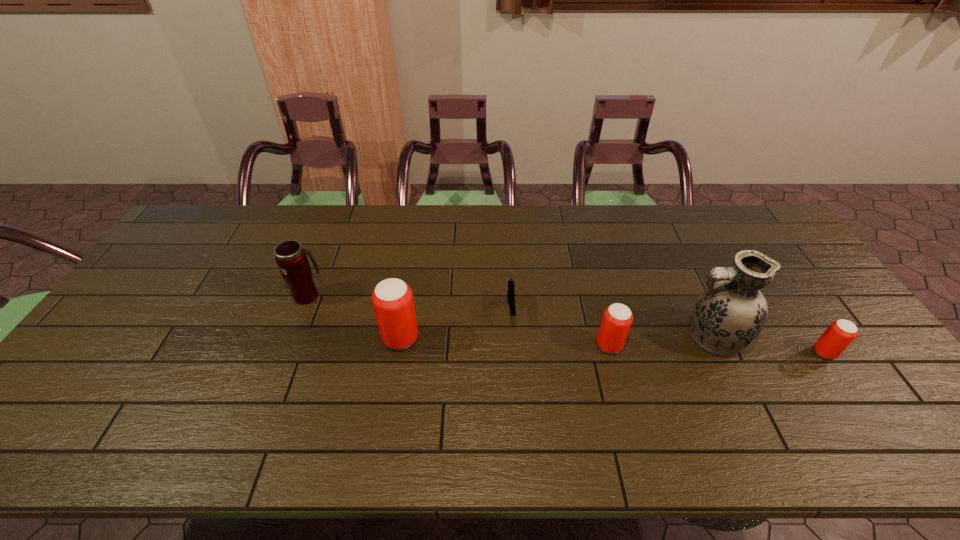
At what (x,y) coordinates should I click in order to perform the action: click on the second object from right to left. Please return your answer as a coordinate pair (x, y). Looking at the image, I should click on (728, 315).

I want to click on vacant area located on the right of the second object from left to right, so click(x=530, y=338).

The width and height of the screenshot is (960, 540). What are the coordinates of `free space located on the left of the second shortest beer can` in the screenshot? It's located at (559, 345).

At what (x,y) coordinates should I click in order to perform the action: click on vacant area located on the back of the shortest beer can. Please return your answer as a coordinate pair (x, y). The width and height of the screenshot is (960, 540). Looking at the image, I should click on (795, 310).

Find the location of a particular element. The image size is (960, 540). free location located 0.240m on the side with the handle of the leftmost object is located at coordinates (331, 235).

The image size is (960, 540). Identify the location of vacant space located on the side with the handle of the leftmost object. (318, 268).

This screenshot has height=540, width=960. I want to click on vacant space located 0.180m on the side with the handle of the leftmost object, so click(326, 246).

Find the location of a particular element. This screenshot has height=540, width=960. vacant point located 0.180m on the front-facing side of the fourth object from right to left is located at coordinates (516, 387).

The width and height of the screenshot is (960, 540). I want to click on free space located 0.200m with the handle on the side of the vase, so click(x=606, y=338).

The width and height of the screenshot is (960, 540). I want to click on vacant region located 0.190m with the handle on the side of the vase, so click(x=610, y=338).